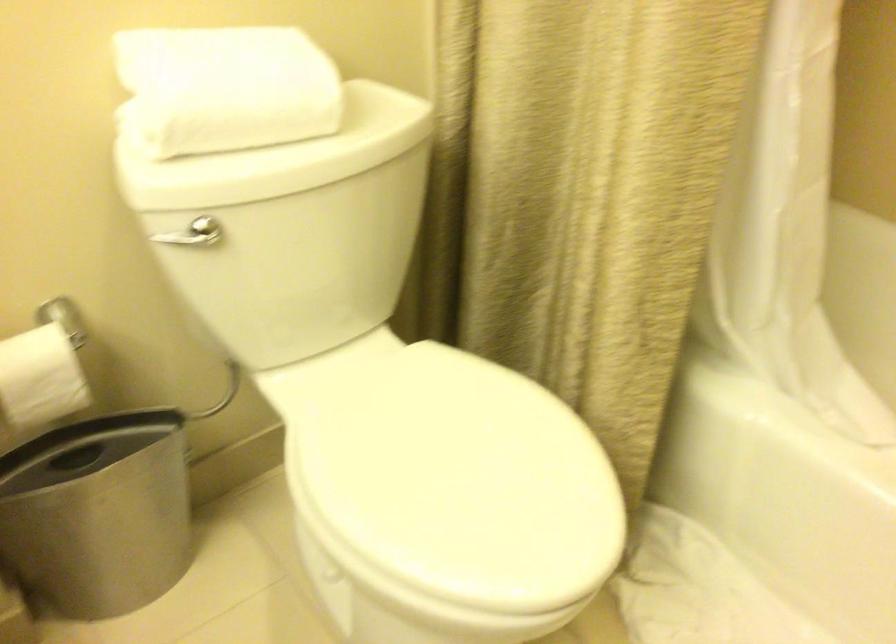
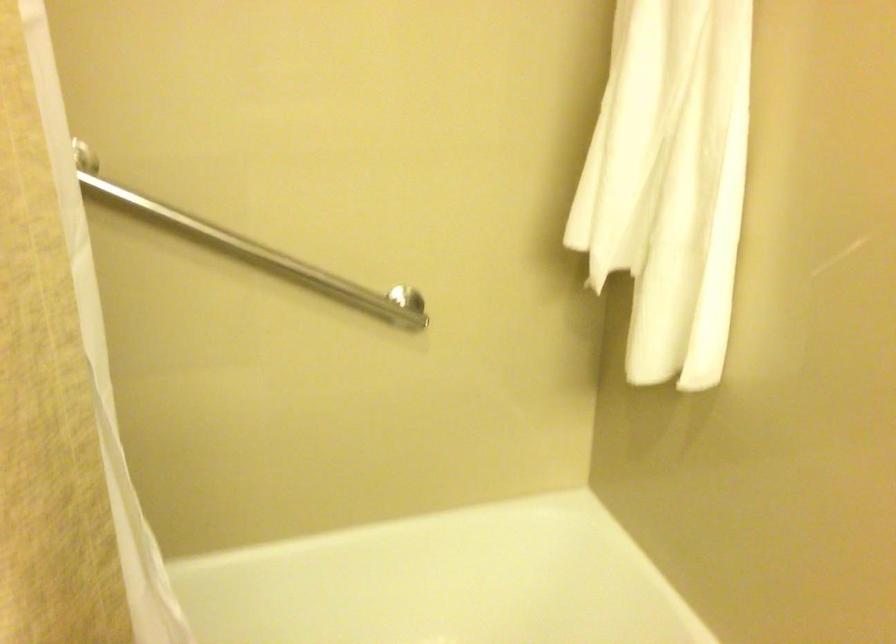
Question: The camera is either moving clockwise (left) or counter-clockwise (right) around the object. The first image is from the beginning of the video and the second image is from the end. Is the camera moving left or right when shooting the video?

Choices:
 (A) Left
 (B) Right

Answer: (A)